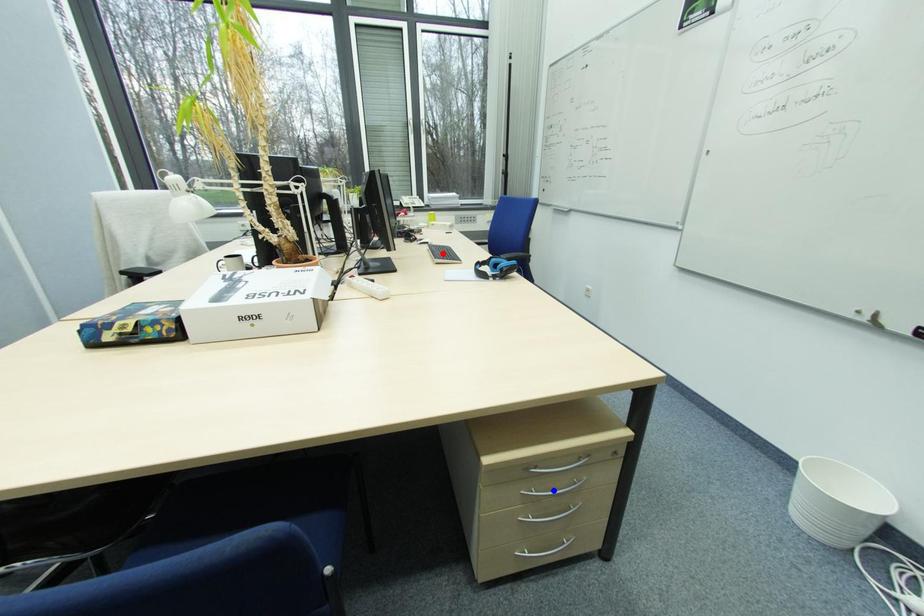
Question: In the image, two points are highlighted. Which point is nearer to the camera? Reply with the corresponding letter.

Choices:
 (A) blue point
 (B) red point

Answer: (A)